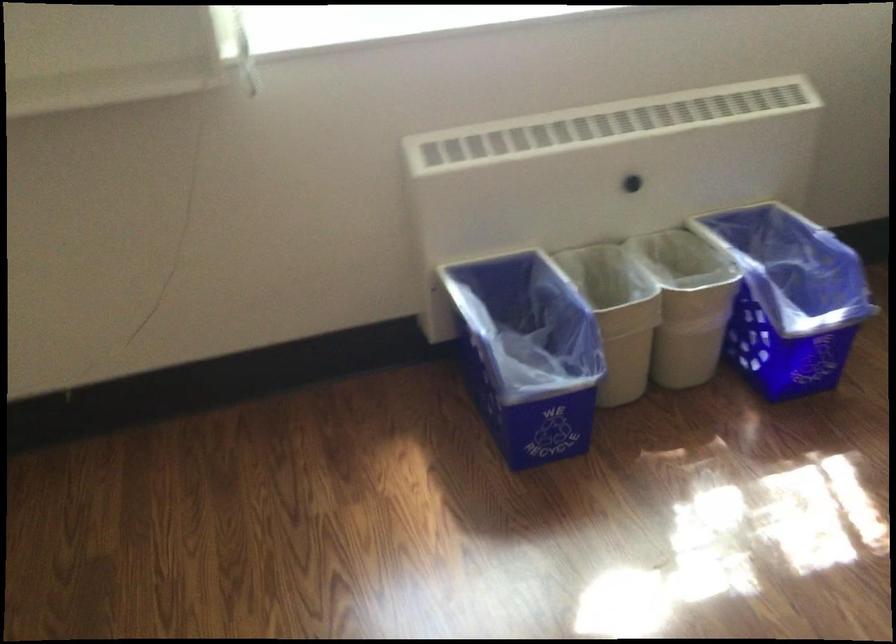
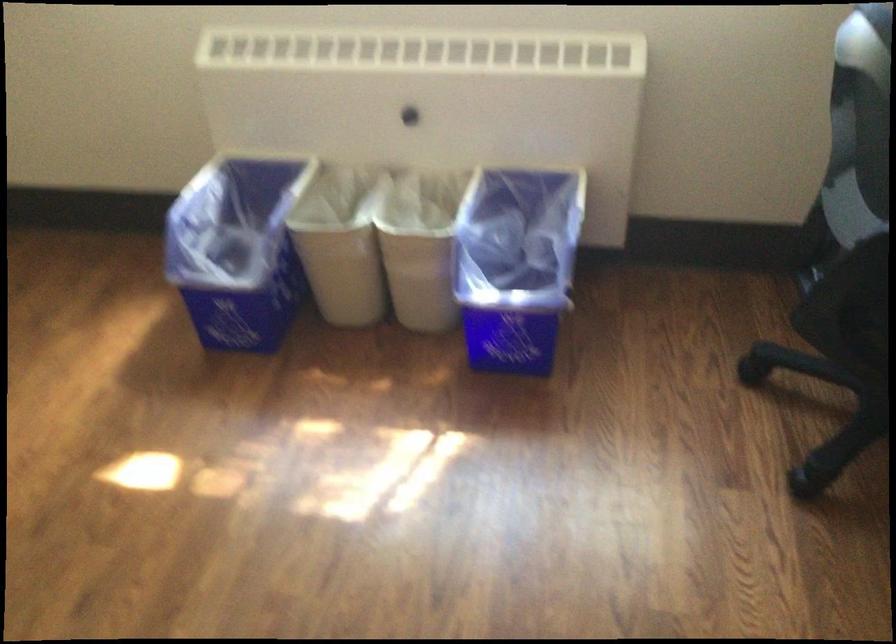
Locate, in the second image, the point that corresponds to (513,354) in the first image.

(237, 249)